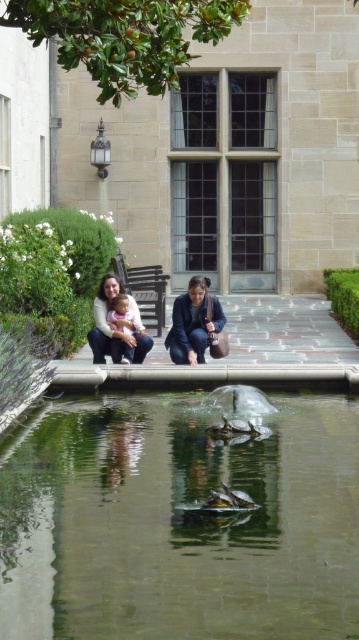
Question: Does clear water at center have a larger size compared to matte black jacket at lower center?

Choices:
 (A) yes
 (B) no

Answer: (B)

Question: Is clear water at center below matte white sweater at center?

Choices:
 (A) no
 (B) yes

Answer: (B)

Question: Among these objects, which one is farthest from the camera?

Choices:
 (A) pink fabric baby at center
 (B) matte white sweater at center
 (C) matte black jacket at lower center
 (D) clear water at center

Answer: (A)

Question: Is matte white sweater at center wider than matte blue jacket at center?

Choices:
 (A) no
 (B) yes

Answer: (B)

Question: Estimate the real-world distances between objects in this image. Which object is closer to the matte black jacket at lower center?

Choices:
 (A) clear water at center
 (B) matte white sweater at center
 (C) pink fabric baby at center
 (D) matte blue jacket at center

Answer: (B)

Question: Among these objects, which one is nearest to the camera?

Choices:
 (A) matte black jacket at lower center
 (B) clear water at center
 (C) pink fabric baby at center

Answer: (B)